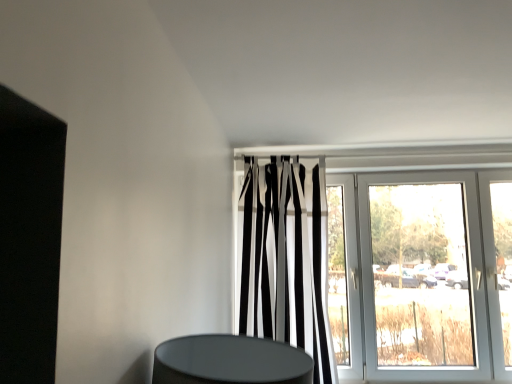
Question: Is white glossy door at upper center in front of black and white striped curtain at center?

Choices:
 (A) no
 (B) yes

Answer: (A)

Question: Does white glossy door at upper center have a lesser height compared to black and white striped curtain at center?

Choices:
 (A) yes
 (B) no

Answer: (A)

Question: Is white glossy door at upper center smaller than black and white striped curtain at center?

Choices:
 (A) yes
 (B) no

Answer: (B)

Question: From the image's perspective, would you say white glossy door at upper center is positioned over black and white striped curtain at center?

Choices:
 (A) no
 (B) yes

Answer: (A)

Question: Is white glossy door at upper center not near black and white striped curtain at center?

Choices:
 (A) yes
 (B) no

Answer: (B)

Question: Is black and white striped curtain at center surrounded by white glossy door at upper center?

Choices:
 (A) yes
 (B) no

Answer: (B)

Question: Does black and white striped curtain at center have a greater height compared to white glossy door at upper center?

Choices:
 (A) no
 (B) yes

Answer: (B)

Question: Is black and white striped curtain at center thinner than white glossy door at upper center?

Choices:
 (A) no
 (B) yes

Answer: (A)

Question: Does black and white striped curtain at center have a larger size compared to white glossy door at upper center?

Choices:
 (A) no
 (B) yes

Answer: (A)

Question: Does black and white striped curtain at center turn towards white glossy door at upper center?

Choices:
 (A) yes
 (B) no

Answer: (B)

Question: From a real-world perspective, is black and white striped curtain at center on top of white glossy door at upper center?

Choices:
 (A) no
 (B) yes

Answer: (B)

Question: Is the position of black and white striped curtain at center more distant than that of white glossy door at upper center?

Choices:
 (A) yes
 (B) no

Answer: (B)

Question: Considering the positions of point pyautogui.click(x=294, y=311) and point pyautogui.click(x=359, y=291), is point pyautogui.click(x=294, y=311) closer or farther from the camera than point pyautogui.click(x=359, y=291)?

Choices:
 (A) farther
 (B) closer

Answer: (B)